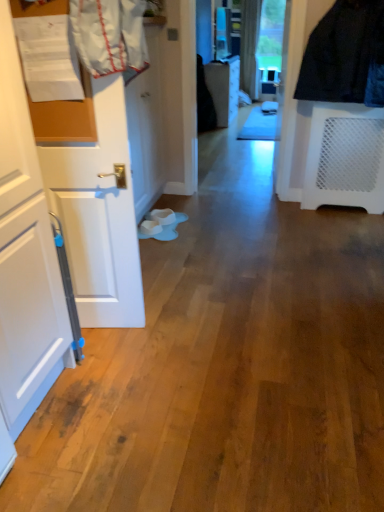
Question: Does white glossy door at center, placed as the second door when sorted from front to back, come behind white fabric laundry at upper left?

Choices:
 (A) no
 (B) yes

Answer: (B)

Question: Is white fabric laundry at upper left at the back of white glossy door at center, the 1th door viewed from the back?

Choices:
 (A) yes
 (B) no

Answer: (B)

Question: From the image's perspective, is white glossy door at center, the 1th door viewed from the back, located beneath white fabric laundry at upper left?

Choices:
 (A) no
 (B) yes

Answer: (A)

Question: Can you confirm if white glossy door at center, the 1th door viewed from the back, is taller than white fabric laundry at upper left?

Choices:
 (A) no
 (B) yes

Answer: (B)

Question: Is white glossy door at center, placed as the second door when sorted from front to back, positioned before white fabric laundry at upper left?

Choices:
 (A) yes
 (B) no

Answer: (B)

Question: Considering the positions of white fabric laundry at upper left and white matte door at left, the second door viewed from the back, in the image, is white fabric laundry at upper left wider or thinner than white matte door at left, the second door viewed from the back,?

Choices:
 (A) wide
 (B) thin

Answer: (A)

Question: In terms of height, does white fabric laundry at upper left look taller or shorter compared to white matte door at left, positioned as the 1th door in front-to-back order?

Choices:
 (A) tall
 (B) short

Answer: (B)

Question: Considering the positions of white fabric laundry at upper left and white matte door at left, positioned as the 1th door in front-to-back order, in the image, is white fabric laundry at upper left bigger or smaller than white matte door at left, positioned as the 1th door in front-to-back order,?

Choices:
 (A) big
 (B) small

Answer: (B)

Question: Considering the positions of point (104, 4) and point (82, 297), is point (104, 4) closer or farther from the camera than point (82, 297)?

Choices:
 (A) farther
 (B) closer

Answer: (B)

Question: In the image, is white glossy door at center, the 1th door viewed from the back, positioned in front of or behind white fabric laundry at upper left?

Choices:
 (A) front
 (B) behind

Answer: (B)

Question: Is white glossy door at center, placed as the second door when sorted from front to back, bigger or smaller than white fabric laundry at upper left?

Choices:
 (A) big
 (B) small

Answer: (A)

Question: Is white glossy door at center, the 1th door viewed from the back, inside or outside of white fabric laundry at upper left?

Choices:
 (A) inside
 (B) outside

Answer: (B)

Question: From the image's perspective, is white glossy door at center, placed as the second door when sorted from front to back, positioned above or below white fabric laundry at upper left?

Choices:
 (A) below
 (B) above

Answer: (B)

Question: From the image's perspective, relative to white matte door at left, the second door viewed from the back, is white glossy door at center, the 1th door viewed from the back, above or below?

Choices:
 (A) above
 (B) below

Answer: (A)

Question: From their relative heights in the image, would you say white glossy door at center, the 1th door viewed from the back, is taller or shorter than white matte door at left, the second door viewed from the back?

Choices:
 (A) short
 (B) tall

Answer: (A)